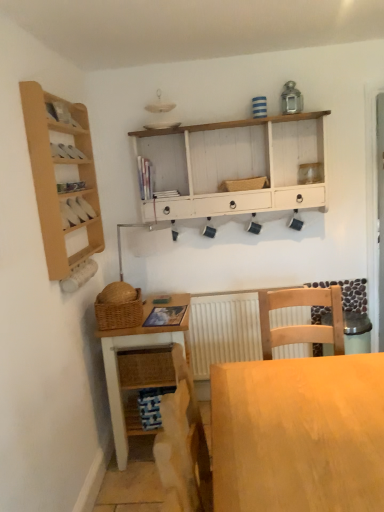
What is the approximate width of wooden cabinet at left?

wooden cabinet at left is 2.06 inches in width.

Describe the element at coordinates (136, 347) in the screenshot. The height and width of the screenshot is (512, 384). I see `wooden table at lower center` at that location.

The width and height of the screenshot is (384, 512). Find the location of `white textured radiator at center`. white textured radiator at center is located at coordinates (224, 330).

Identify the location of woven straw basket at center. (244, 184).

Where is `wooden cabinet at left`? The height and width of the screenshot is (512, 384). wooden cabinet at left is located at coordinates (76, 211).

From the image's perspective, would you say woven straw basket at center is positioned over light wood shelf at left?

Indeed, from the image's perspective, woven straw basket at center is shown above light wood shelf at left.

Based on their positions, is woven straw basket at center located to the left or right of light wood shelf at left?

woven straw basket at center is positioned on light wood shelf at left's right side.

Which object is wider, woven straw basket at center or light wood shelf at left?

Wider between the two is woven straw basket at center.

Would you say woven straw basket at center is outside light wood shelf at left?

Yes, woven straw basket at center is located beyond the bounds of light wood shelf at left.

Between point (354, 384) and point (315, 179), which one is positioned behind?

The point (315, 179) is behind.

Is light wood desk at center at the left side of white painted wood cabinet at upper center?

No.

Who is smaller, light wood desk at center or white painted wood cabinet at upper center?

With smaller size is white painted wood cabinet at upper center.

Is light wood desk at center facing away from white painted wood cabinet at upper center?

No, light wood desk at center is not facing away from white painted wood cabinet at upper center.

Who is taller, white textured radiator at center or light wood shelf at left?

light wood shelf at left.

Between white textured radiator at center and light wood shelf at left, which one appears on the left side from the viewer's perspective?

light wood shelf at left is more to the left.

Identify the location of shelf to the left of white textured radiator at center. (63, 181).

Looking at this image, considering the sizes of objects white textured radiator at center and light wood shelf at left in the image provided, who is wider, white textured radiator at center or light wood shelf at left?

With larger width is white textured radiator at center.

Does light wood shelf at left contain woven straw basket at center?

Definitely not — woven straw basket at center is not inside light wood shelf at left.

Based on the photo, from the image's perspective, is light wood shelf at left above or below woven straw basket at center?

Clearly, from the image's perspective, light wood shelf at left is below woven straw basket at center.

You are a GUI agent. You are given a task and a screenshot of the screen. Output one action in this format:
    pyautogui.click(x=<x>, y=<y>)
    Task: Click on the basket lying behind the light wood shelf at left
    This screenshot has width=384, height=512.
    Given the screenshot: What is the action you would take?
    pyautogui.click(x=244, y=184)

Which of these two, light wood shelf at left or woven straw basket at center, is smaller?

woven straw basket at center is smaller.

Can you confirm if white textured radiator at center is positioned to the right of wooden table at lower center?

Yes.

Does white textured radiator at center have a larger size compared to wooden table at lower center?

Actually, white textured radiator at center might be smaller than wooden table at lower center.

Can you tell me how much white textured radiator at center and wooden table at lower center differ in facing direction?

They differ by 91.8 degrees in their facing directions.

Is point (235, 343) farther from camera compared to point (107, 333)?

Yes.

Measure the distance between woven brown picnic basket at lower left and wooden cabinet at left.

A distance of 19.56 inches exists between woven brown picnic basket at lower left and wooden cabinet at left.

Does woven brown picnic basket at lower left appear on the right side of wooden cabinet at left?

Indeed, woven brown picnic basket at lower left is positioned on the right side of wooden cabinet at left.

Can wooden cabinet at left be found inside woven brown picnic basket at lower left?

That's incorrect, wooden cabinet at left is not inside woven brown picnic basket at lower left.

From a real-world perspective, is woven brown picnic basket at lower left located higher than wooden cabinet at left?

No, from a real-world perspective, woven brown picnic basket at lower left is not on top of wooden cabinet at left.

Does light wood desk at center have a greater width compared to light wood shelf at left?

Indeed, light wood desk at center has a greater width compared to light wood shelf at left.

Between light wood desk at center and light wood shelf at left, which one has less height?

With less height is light wood desk at center.

Is the depth of light wood desk at center less than that of light wood shelf at left?

Yes, light wood desk at center is closer to the camera.

Does light wood desk at center have a smaller size compared to light wood shelf at left?

No, light wood desk at center is not smaller than light wood shelf at left.

I want to click on shelf that is in front of the woven straw basket at center, so click(63, 181).

Identify the location of cabinetry that is above the light wood desk at center (from the image's perspective). This screenshot has height=512, width=384. (245, 167).

Estimate the real-world distances between objects in this image. Which object is closer to light wood desk at center, white painted wood cabinet at upper center or white textured radiator at center?

Among the two, white textured radiator at center is located nearer to light wood desk at center.

Based on their spatial positions, is woven brown picnic basket at lower left or light wood shelf at left further from white textured radiator at center?

light wood shelf at left lies further to white textured radiator at center than the other object.

Based on their spatial positions, is light wood shelf at left or woven brown picnic basket at lower left closer to white textured radiator at center?

woven brown picnic basket at lower left is positioned closer to the anchor white textured radiator at center.

Looking at the image, which one is located closer to white painted wood cabinet at upper center, woven straw basket at center or wooden cabinet at left?

woven straw basket at center is closer to white painted wood cabinet at upper center.

When comparing their distances from light wood desk at center, does woven brown picnic basket at lower left or wooden cabinet at left seem closer?

The object closer to light wood desk at center is woven brown picnic basket at lower left.

Looking at the image, which one is located further to light wood shelf at left, wooden cabinet at left or wooden table at lower center?

Based on the image, wooden table at lower center appears to be further to light wood shelf at left.

When comparing their distances from white painted wood cabinet at upper center, does light wood shelf at left or wooden cabinet at left seem further?

wooden cabinet at left is further to white painted wood cabinet at upper center.

From the image, which object appears to be farther from woven straw basket at center, woven brown picnic basket at lower left or light wood desk at center?

light wood desk at center is further to woven straw basket at center.

Where is `picnic basket between white painted wood cabinet at upper center and wooden table at lower center from top to bottom`? picnic basket between white painted wood cabinet at upper center and wooden table at lower center from top to bottom is located at coordinates [x=118, y=308].

Locate an element on the screen. The height and width of the screenshot is (512, 384). radiator that lies between wooden cabinet at left and wooden table at lower center from top to bottom is located at coordinates (224, 330).

Locate an element on the screen. cabinet between light wood shelf at left and light wood desk at center in the up-down direction is located at coordinates (76, 211).

Image resolution: width=384 pixels, height=512 pixels. In order to click on radiator between light wood shelf at left and wooden table at lower center from top to bottom in this screenshot , I will do `click(224, 330)`.